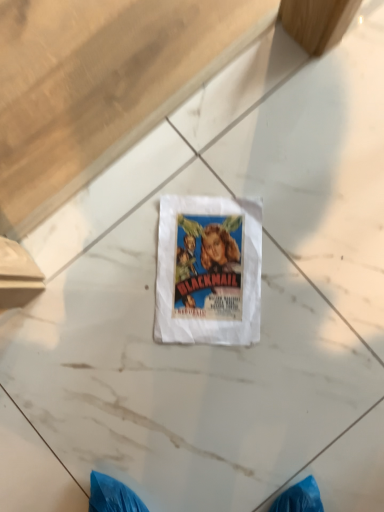
This screenshot has height=512, width=384. In order to click on vacant space positioned to the left of colorful paper poster at center in this screenshot , I will do `click(110, 311)`.